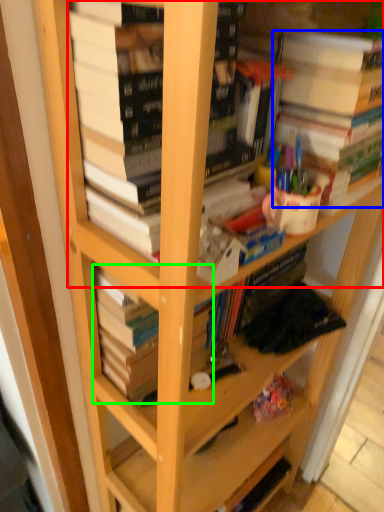
Question: Which object is the closest to the book (highlighted by a red box)? Choose among these: book (highlighted by a blue box) or book (highlighted by a green box).

Choices:
 (A) book
 (B) book

Answer: (A)